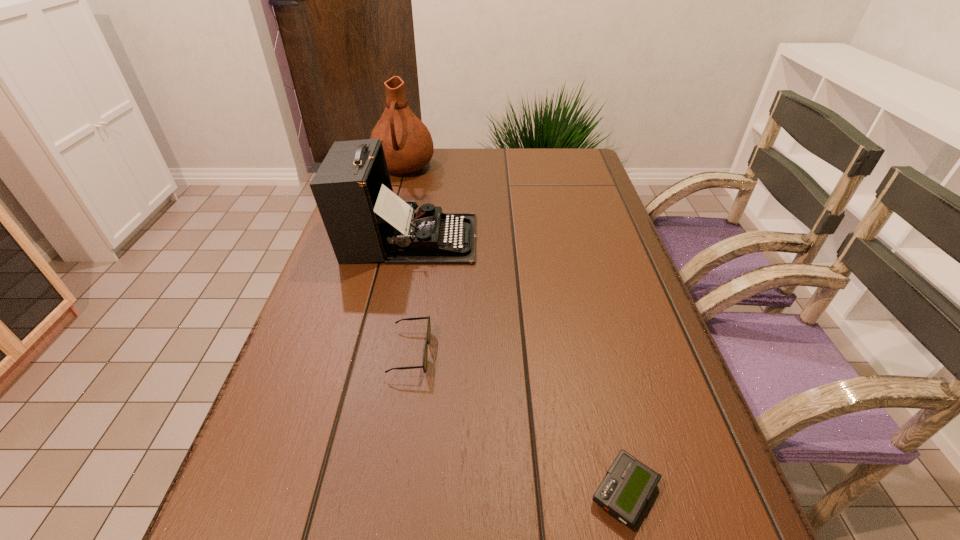
Image resolution: width=960 pixels, height=540 pixels. What are the coordinates of `free space that satisfies the following two spatial constraints: 1. on the front-facing side of the third farthest object; 2. on the back side of the beeper` in the screenshot? It's located at (389, 492).

Where is `vacant area in the image that satisfies the following two spatial constraints: 1. inside the open case of the second farthest object; 2. on the back side of the nearest object`? vacant area in the image that satisfies the following two spatial constraints: 1. inside the open case of the second farthest object; 2. on the back side of the nearest object is located at coordinates (357, 492).

Locate an element on the screen. The image size is (960, 540). vacant region that satisfies the following two spatial constraints: 1. on the side of the beeper with the handle; 2. on the left side of the farthest object is located at coordinates (314, 492).

Identify the location of free location that satisfies the following two spatial constraints: 1. inside the open case of the third nearest object; 2. on the right side of the nearest object. (357, 492).

Find the location of `free space that satisfies the following two spatial constraints: 1. inside the open case of the beeper; 2. on the left side of the typewriter`. free space that satisfies the following two spatial constraints: 1. inside the open case of the beeper; 2. on the left side of the typewriter is located at coordinates (357, 492).

In order to click on free point that satisfies the following two spatial constraints: 1. on the side of the shortest object with the handle; 2. on the left side of the pitcher in this screenshot , I will do `click(314, 492)`.

What are the coordinates of `free location that satisfies the following two spatial constraints: 1. on the side of the beeper with the handle; 2. on the right side of the pitcher` in the screenshot? It's located at (314, 492).

This screenshot has width=960, height=540. I want to click on free space that satisfies the following two spatial constraints: 1. on the front-facing side of the beeper; 2. on the right side of the second shortest object, so click(389, 492).